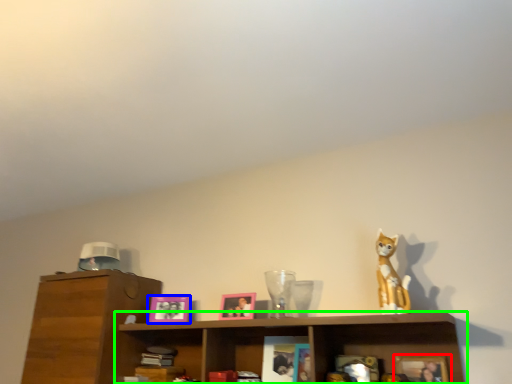
Question: Which object is positioned closest to picture frame (highlighted by a red box)? Select from picture frame (highlighted by a blue box) and shelf (highlighted by a green box).

Choices:
 (A) picture frame
 (B) shelf

Answer: (B)